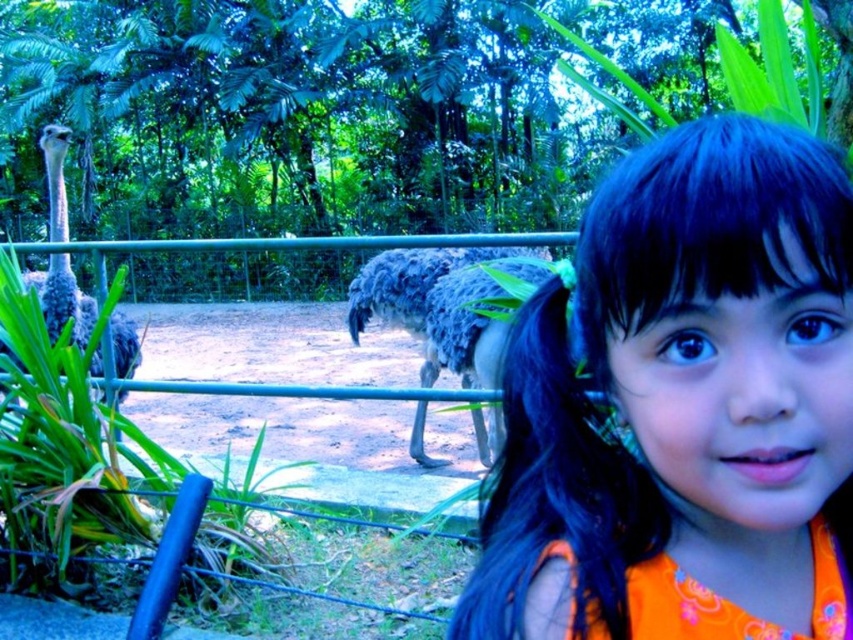
You are a photographer trying to capture a clear shot of the two points in the image. The first point is labeled as point (631, 164) and the second is point (51, 138). Since you want to focus on the one that is nearer to the camera, which point should you aim your camera at?

Point (631, 164) is closer to the camera than point (51, 138), so you should aim your camera at point (631, 164) to focus on the one that is nearer.

You are a photographer adjusting your camera settings to focus on two points in the image. The first point is at coordinates point (x=393, y=321) and the second is at point (x=59, y=307). Which point is closer to the camera?

Point (x=393, y=321) is further to the camera than point (x=59, y=307), so the second point is closer.

You are a photographer trying to capture a clear shot of the two points in the image. The first point is labeled as point (589,544) and the second is point (490,372). Since you want to focus on the one that is closer to the camera, which point should you aim your camera at?

Point (589,544) is closer to the camera than point (490,372), so you should aim your camera at point (589,544) to focus on the one that is closer.